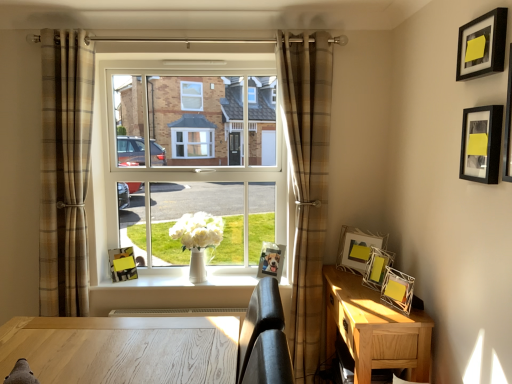
Question: Can you confirm if metallic silver picture frame at right, which is the 4th picture frame in left-to-right order, is wider than clear glass window at center?

Choices:
 (A) no
 (B) yes

Answer: (B)

Question: Does metallic silver picture frame at right, positioned as the 3th picture frame in right-to-left order, touch clear glass window at center?

Choices:
 (A) no
 (B) yes

Answer: (A)

Question: Is metallic silver picture frame at right, the third picture frame from the front, behind clear glass window at center?

Choices:
 (A) yes
 (B) no

Answer: (B)

Question: From the image's perspective, is metallic silver picture frame at right, which is the fourth picture frame from back to front, beneath clear glass window at center?

Choices:
 (A) no
 (B) yes

Answer: (B)

Question: Does metallic silver picture frame at right, positioned as the 3th picture frame in right-to-left order, appear on the right side of clear glass window at center?

Choices:
 (A) yes
 (B) no

Answer: (A)

Question: From a real-world perspective, is metallic silver picture frame at right, positioned as the 3th picture frame in right-to-left order, on clear glass window at center?

Choices:
 (A) yes
 (B) no

Answer: (B)

Question: From the image's perspective, is metallic silver photo frame at center, the 5th picture frame positioned from the right, beneath clear glass window at center?

Choices:
 (A) yes
 (B) no

Answer: (A)

Question: Considering the relative sizes of metallic silver photo frame at center, the 5th picture frame positioned from the right, and clear glass window at center in the image provided, is metallic silver photo frame at center, the 5th picture frame positioned from the right, bigger than clear glass window at center?

Choices:
 (A) yes
 (B) no

Answer: (B)

Question: Is metallic silver photo frame at center, the 2th picture frame from the back, at the left side of clear glass window at center?

Choices:
 (A) no
 (B) yes

Answer: (A)

Question: From a real-world perspective, is metallic silver photo frame at center, placed as the second picture frame when sorted from left to right, on clear glass window at center?

Choices:
 (A) no
 (B) yes

Answer: (A)

Question: Is clear glass window at center inside metallic silver photo frame at center, placed as the second picture frame when sorted from left to right?

Choices:
 (A) no
 (B) yes

Answer: (A)

Question: Considering the relative sizes of metallic silver photo frame at center, placed as the second picture frame when sorted from left to right, and clear glass window at center in the image provided, is metallic silver photo frame at center, placed as the second picture frame when sorted from left to right, thinner than clear glass window at center?

Choices:
 (A) yes
 (B) no

Answer: (B)

Question: Can you confirm if white glossy vase at center is thinner than metallic silver photo frame at center, the 5th picture frame positioned from the right?

Choices:
 (A) no
 (B) yes

Answer: (A)